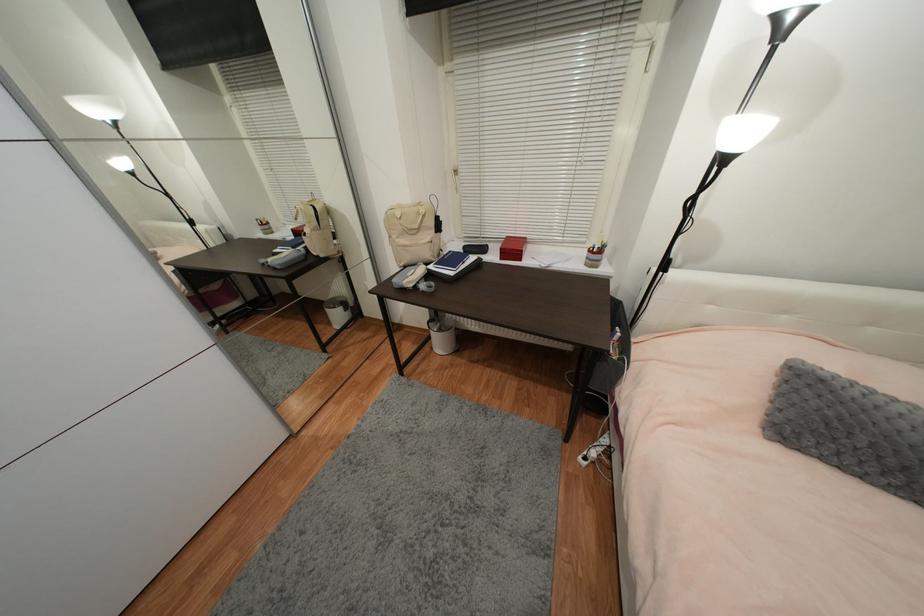
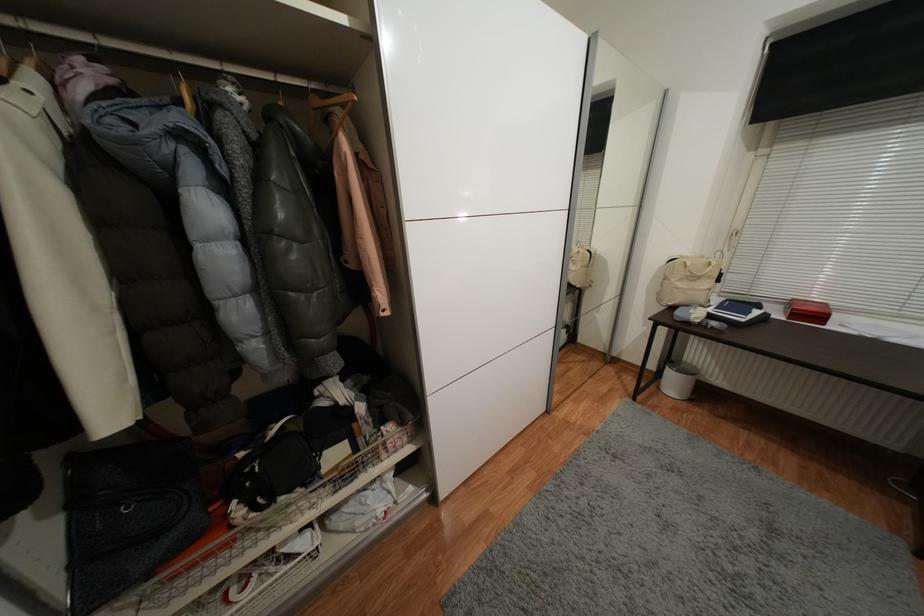
Locate, in the second image, the point that corresponds to point 423,205 in the first image.

(707, 257)